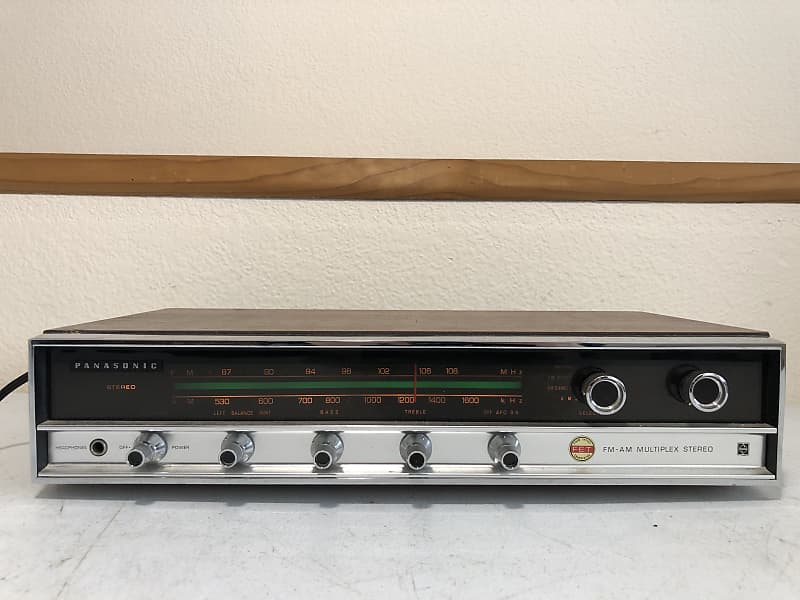
Where is `table`? table is located at coordinates (349, 556).